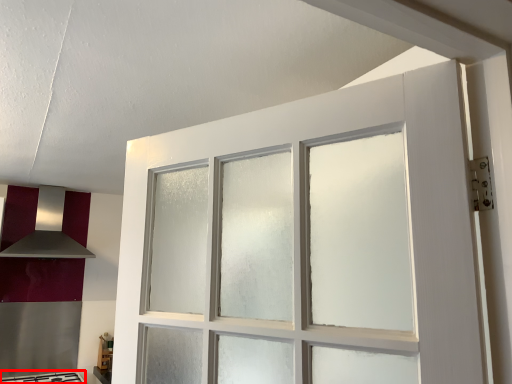
Question: Considering the relative positions of gas stove (annotated by the red box) and exhaust hood in the image provided, where is gas stove (annotated by the red box) located with respect to the staircase?

Choices:
 (A) left
 (B) right

Answer: (B)